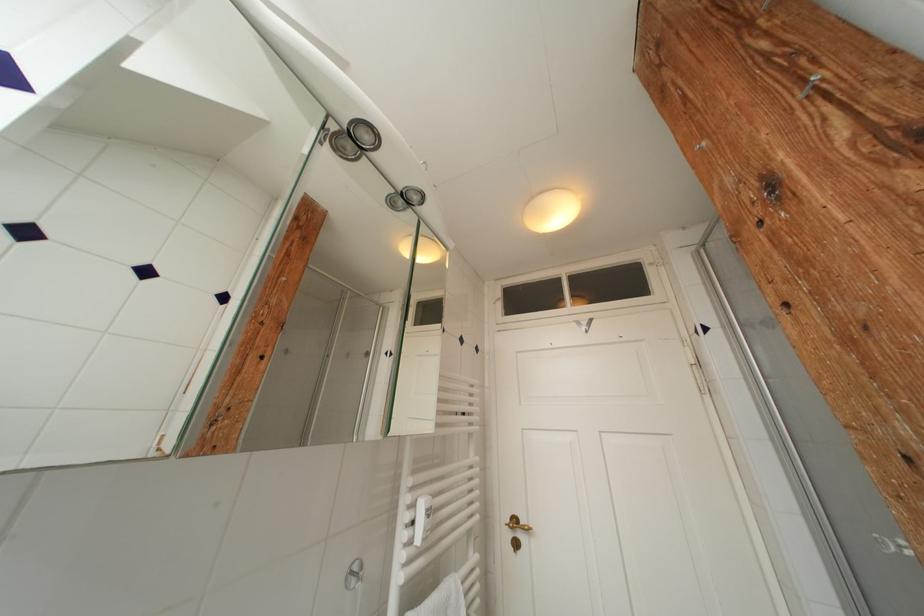
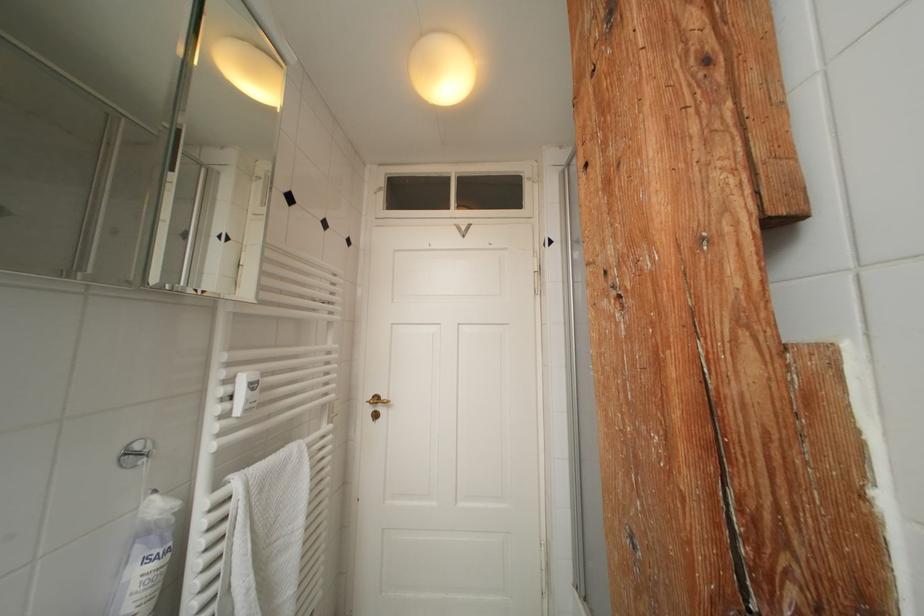
First-person continuous shooting, in which direction is the camera rotating?

The camera's rotation is toward right-down.